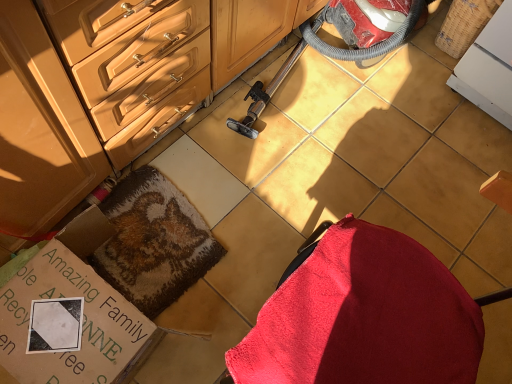
I want to click on unoccupied region to the right of fluffy brown rug at center, so click(251, 243).